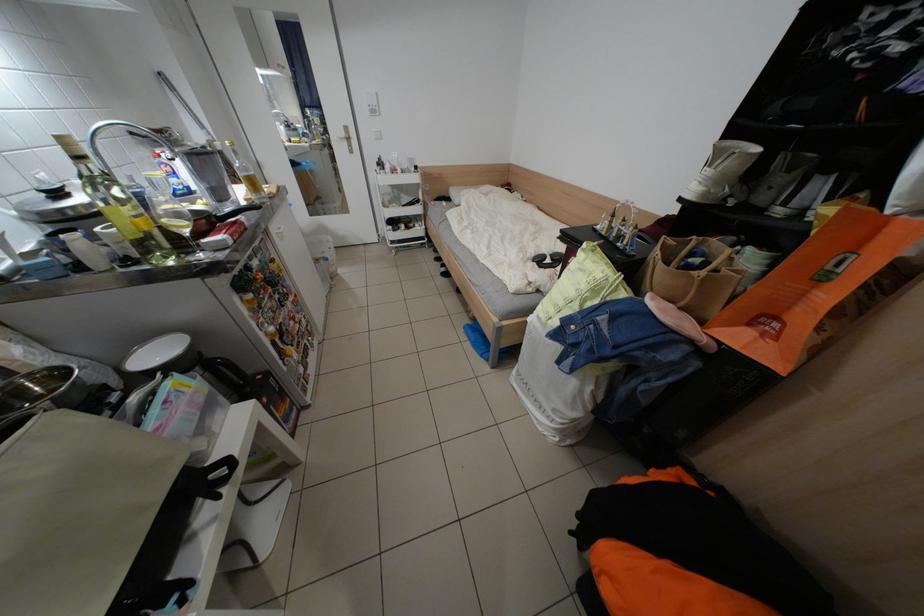
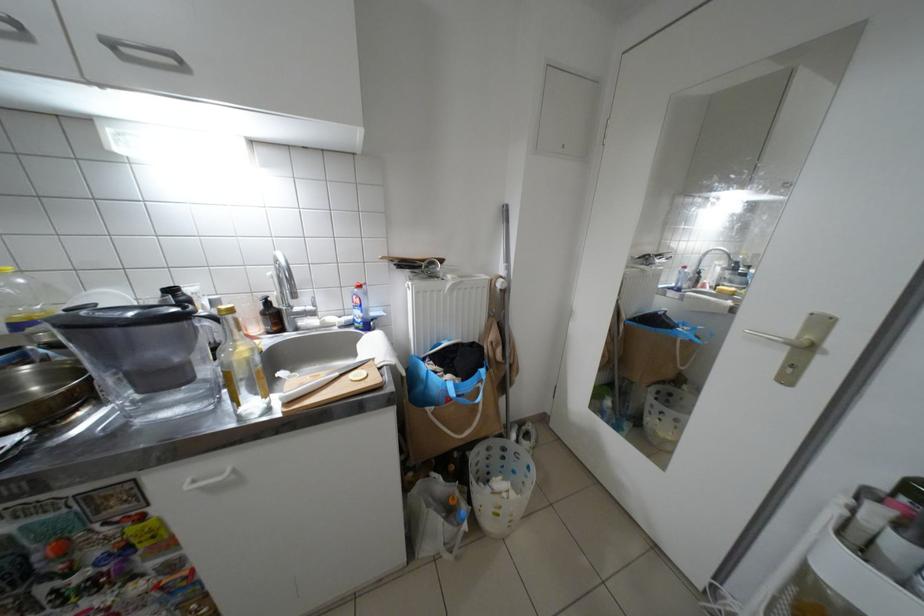
Where in the second image is the point corresponding to pixel 226 185 from the first image?

(139, 369)